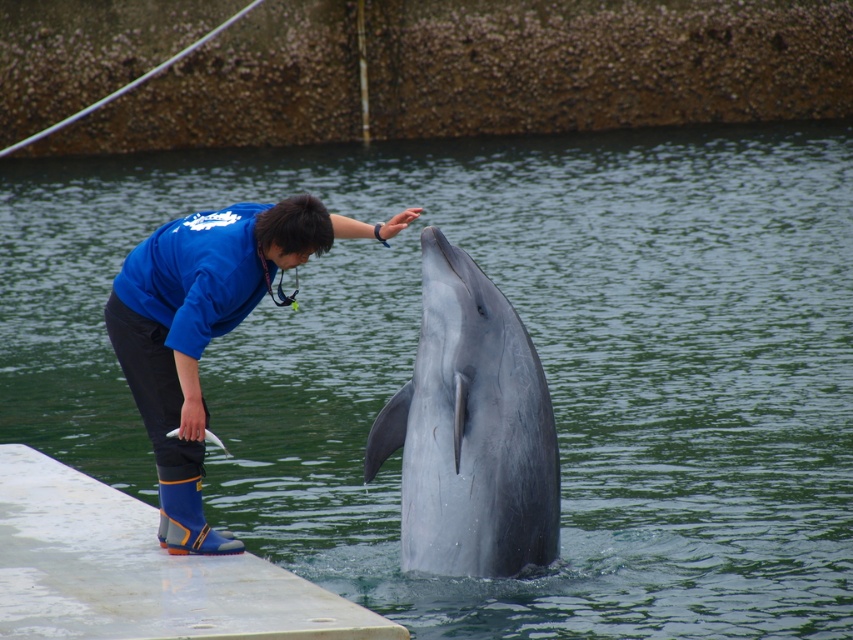
You are a visitor at the dolphin interaction area and want to take a photo of the white concrete dock at lower left and the blue fleece jacket at center. Which object should you focus on first if you want to capture both in the same frame without moving your camera?

The white concrete dock at lower left is smaller than the blue fleece jacket at center, so you should focus on the blue fleece jacket at center first to ensure it fits properly in the frame.

You are a visitor at the dolphin interaction area. You see the white concrete dock at lower left and the blue fleece jacket at center. Which object is taller?

The blue fleece jacket at center is taller than the white concrete dock at lower left.

You are a visitor at the dolphin interaction area and want to take a photo of the gray smooth dolphin at center and the white concrete dock at lower left in the same frame. Based on their positions, is the dolphin positioned higher or lower than the dock?

The gray smooth dolphin at center is located above the white concrete dock at lower left, so the dolphin is positioned higher than the dock.